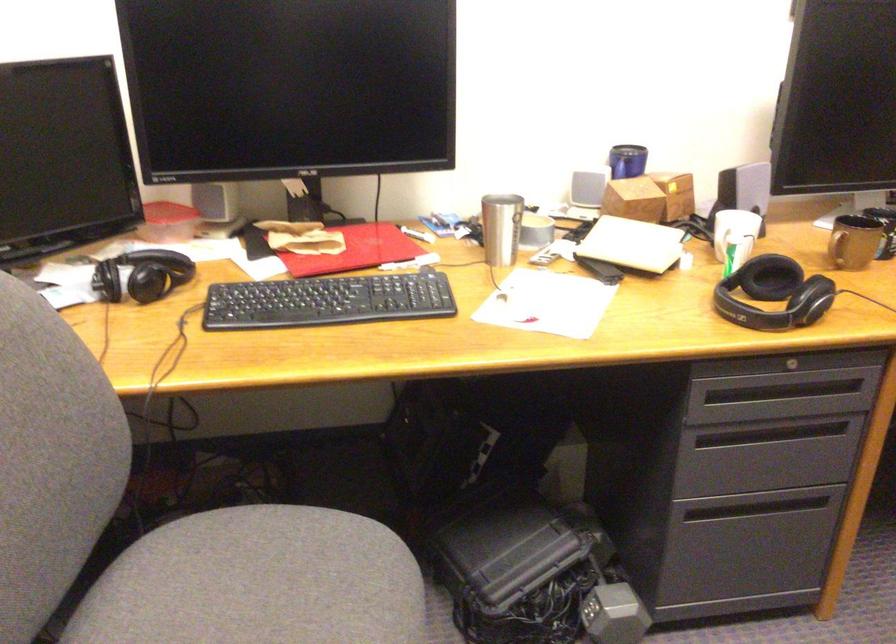
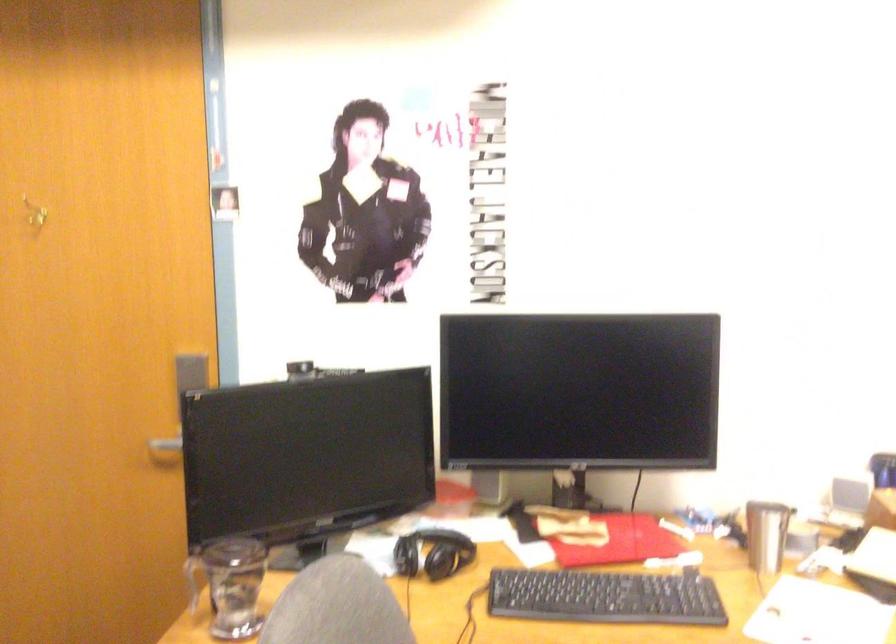
The images are taken continuously from a first-person perspective. In which direction is your viewpoint rotating?

The camera's rotation is toward left-up.